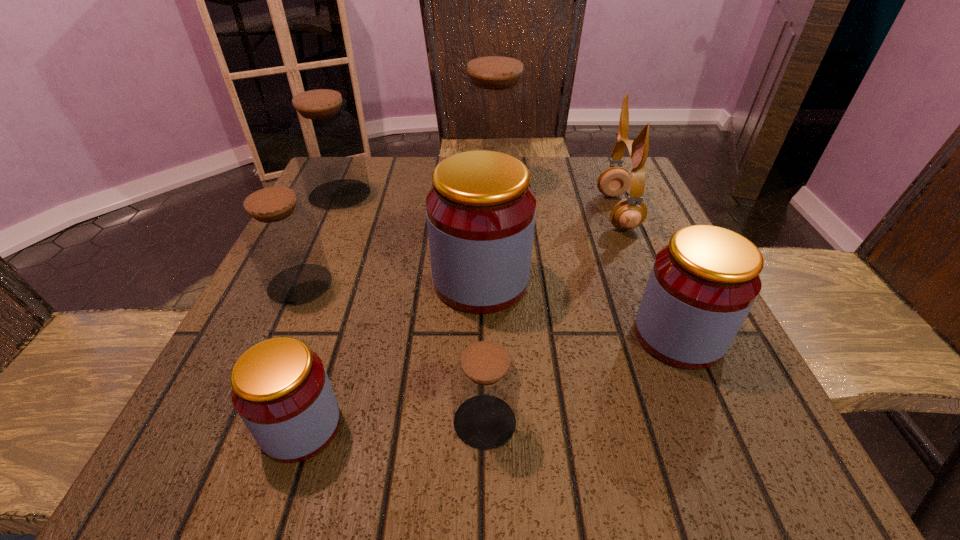
Find the location of a particular element. the biggest brown jar is located at coordinates (495, 113).

Image resolution: width=960 pixels, height=540 pixels. In order to click on earphone in this screenshot , I will do `click(629, 213)`.

Locate an element on the screen. Image resolution: width=960 pixels, height=540 pixels. the second biggest brown jar is located at coordinates (326, 140).

Find the location of a particular element. the biggest red jar is located at coordinates (480, 213).

The height and width of the screenshot is (540, 960). I want to click on the third biggest brown jar, so click(282, 237).

Identify the location of the rightmost red jar. Image resolution: width=960 pixels, height=540 pixels. pyautogui.click(x=702, y=285).

Where is `the rightmost jar`? The width and height of the screenshot is (960, 540). the rightmost jar is located at coordinates (702, 285).

Locate an element on the screen. The image size is (960, 540). the leftmost red jar is located at coordinates (280, 388).

Where is `the nearest red jar`? the nearest red jar is located at coordinates (280, 388).

You are a GUI agent. You are given a task and a screenshot of the screen. Output one action in this format:
    pyautogui.click(x=<x>, y=<y>)
    Task: Click on the nearest brown jar
    Image resolution: width=960 pixels, height=540 pixels.
    Given the screenshot: What is the action you would take?
    pyautogui.click(x=485, y=384)